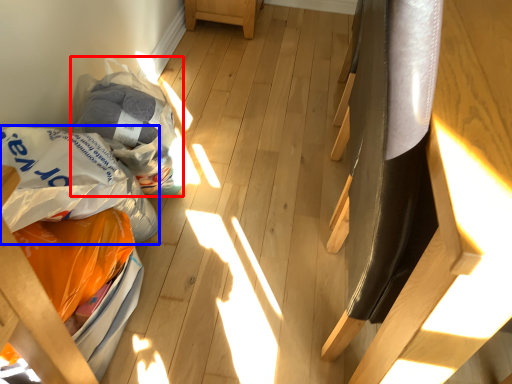
Question: Which of the following is the farthest to the observer, grocery bag (highlighted by a red box) or grocery bag (highlighted by a blue box)?

Choices:
 (A) grocery bag
 (B) grocery bag

Answer: (A)